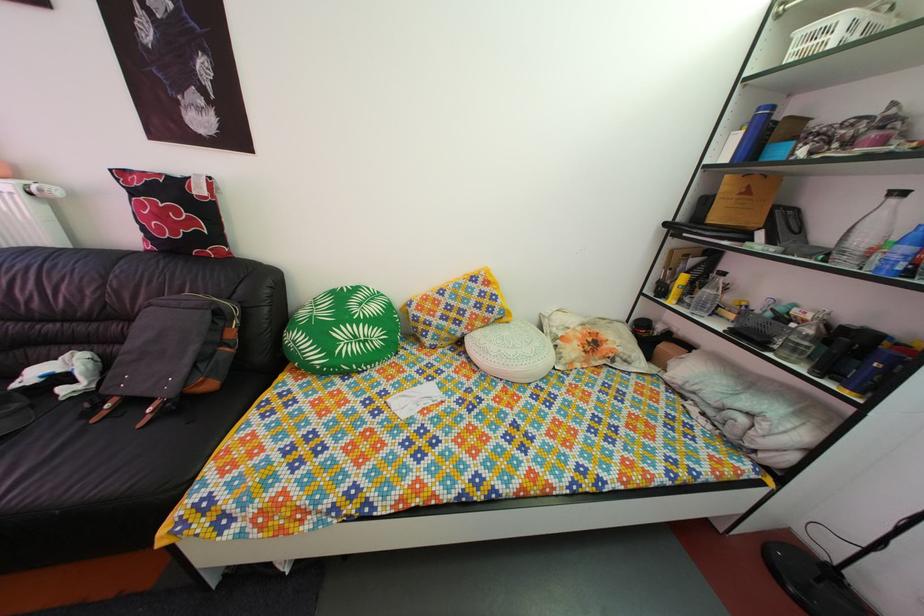
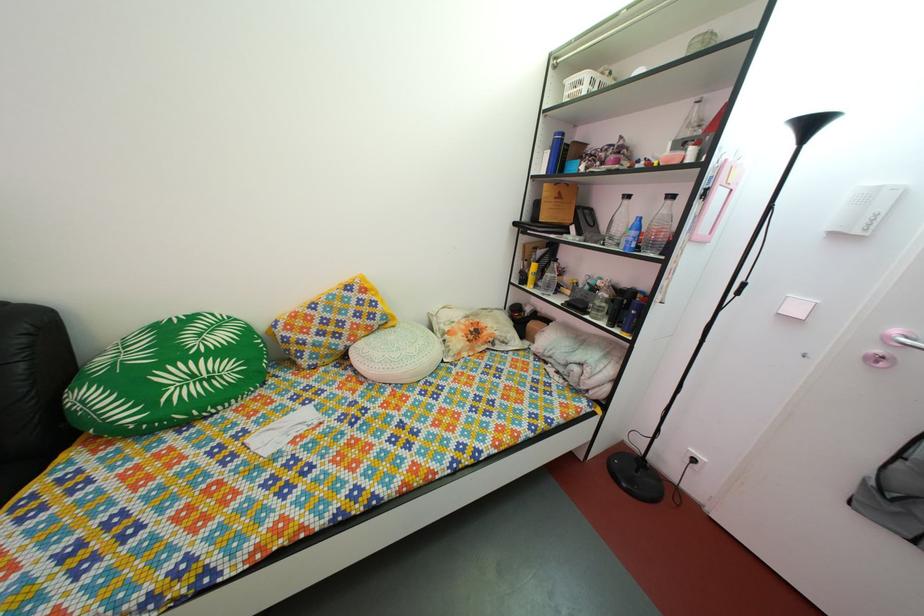
Find the pixel in the second image that matches the point at 685,300 in the first image.

(540, 286)